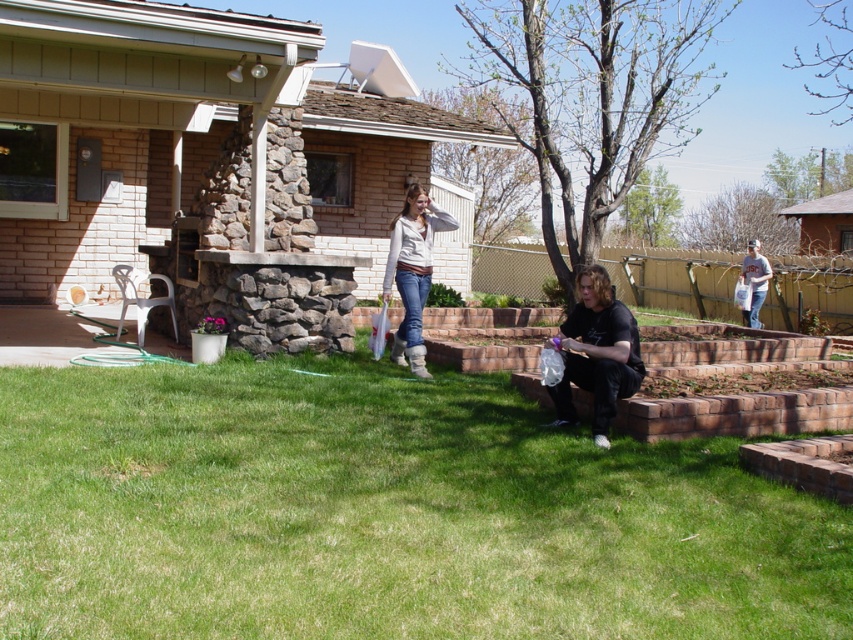
Looking at this image, you are a gardener who wants to plant a new flower bed. You have a small shovel that is 12 inches long. The flower bed needs to be placed where the green grass at lower center and the matte white sweater at center are located. Which location would allow the shovel to reach the ground easily?

The green grass at lower center is shorter than the matte white sweater at center, so the shovel can reach the ground more easily at the green grass at lower center location.

You are standing in the backyard and want to place a small potted plant exactly at the center of the green grass at lower center. According to the image, what are the coordinates where you should place the potted plant?

The coordinates for the center of the green grass at lower center are at point (383, 513), so you should place the potted plant there.